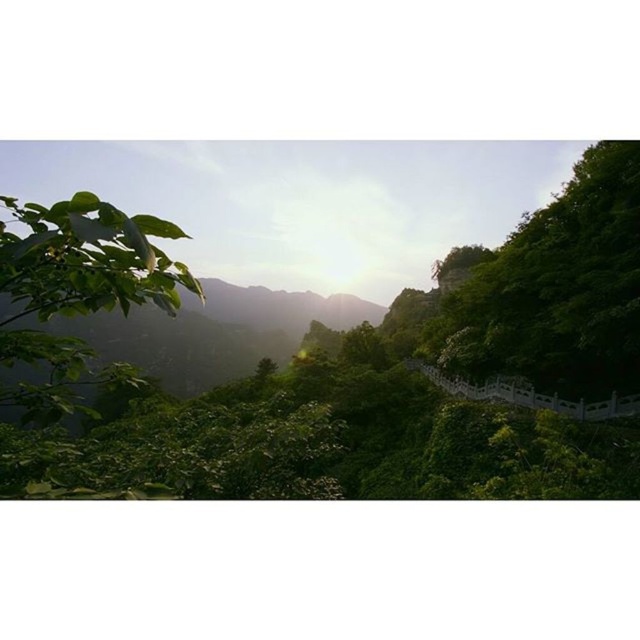
Question: Is green leafy tree at right bigger than green leafy tree at left?

Choices:
 (A) yes
 (B) no

Answer: (B)

Question: Considering the relative positions of green leafy tree at right and green leafy tree at left in the image provided, where is green leafy tree at right located with respect to green leafy tree at left?

Choices:
 (A) above
 (B) below

Answer: (A)

Question: Is green leafy tree at right above green leafy tree at left?

Choices:
 (A) yes
 (B) no

Answer: (A)